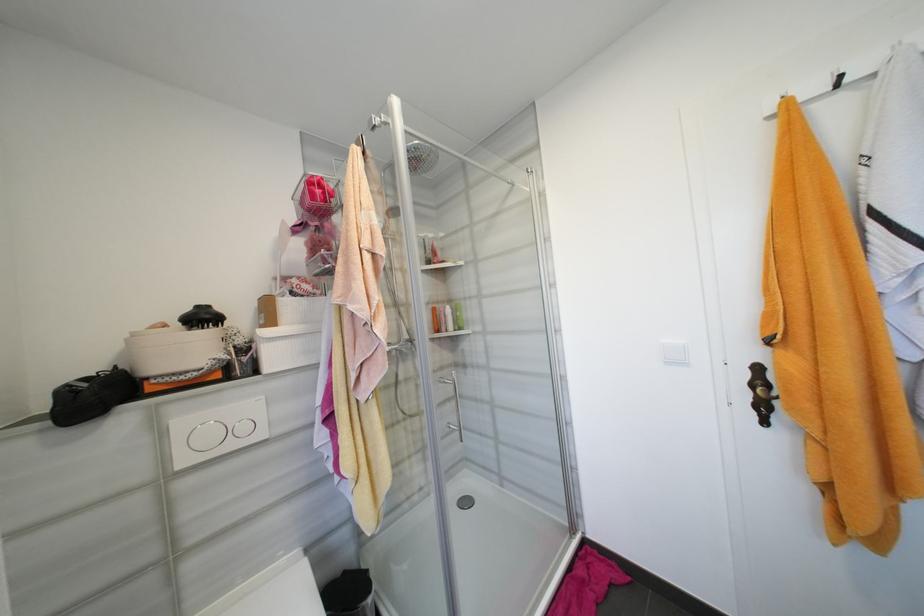
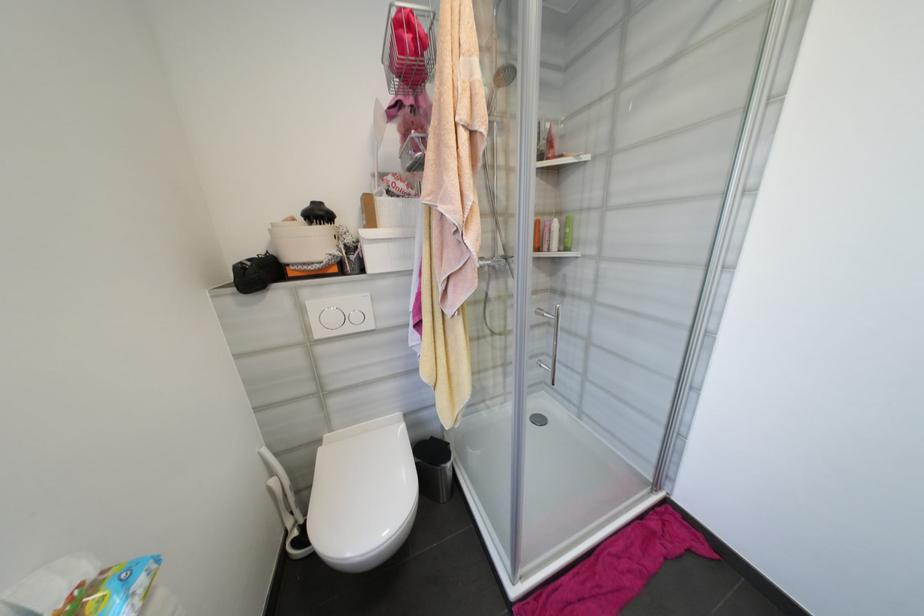
Locate, in the second image, the point that corresponds to (x=396, y=204) in the first image.

(506, 63)